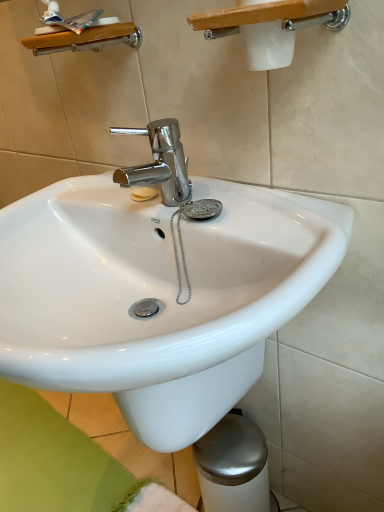
Question: Is white plastic shower at upper center, the second shower positioned from the back, at the left side of wooden shelf at upper left, the first shower in the back-to-front sequence?

Choices:
 (A) no
 (B) yes

Answer: (A)

Question: From the image's perspective, is white plastic shower at upper center, the 1th shower positioned from the right, under wooden shelf at upper left, the first shower in the back-to-front sequence?

Choices:
 (A) yes
 (B) no

Answer: (A)

Question: Is white plastic shower at upper center, the second shower positioned from the back, smaller than wooden shelf at upper left, the 1th shower viewed from the left?

Choices:
 (A) yes
 (B) no

Answer: (B)

Question: From a real-world perspective, is white plastic shower at upper center, the second shower in the left-to-right sequence, on top of wooden shelf at upper left, the first shower in the back-to-front sequence?

Choices:
 (A) yes
 (B) no

Answer: (B)

Question: Is there a large distance between white plastic shower at upper center, the 1th shower positioned from the right, and wooden shelf at upper left, the first shower in the back-to-front sequence?

Choices:
 (A) yes
 (B) no

Answer: (B)

Question: Does white plastic shower at upper center, the second shower positioned from the back, lie in front of wooden shelf at upper left, the second shower from the front?

Choices:
 (A) no
 (B) yes

Answer: (B)

Question: From the image's perspective, would you say white glossy sink at center is positioned over white plastic shower at upper center, the second shower positioned from the back?

Choices:
 (A) yes
 (B) no

Answer: (B)

Question: Does white glossy sink at center appear on the right side of white plastic shower at upper center, the second shower in the left-to-right sequence?

Choices:
 (A) no
 (B) yes

Answer: (A)

Question: Considering the relative sizes of white glossy sink at center and white plastic shower at upper center, which is the first shower in front-to-back order, in the image provided, is white glossy sink at center shorter than white plastic shower at upper center, which is the first shower in front-to-back order,?

Choices:
 (A) yes
 (B) no

Answer: (B)

Question: Is white glossy sink at center turned away from white plastic shower at upper center, the 1th shower positioned from the right?

Choices:
 (A) no
 (B) yes

Answer: (A)

Question: Considering the relative positions of white glossy sink at center and white plastic shower at upper center, the 1th shower positioned from the right, in the image provided, is white glossy sink at center in front of white plastic shower at upper center, the 1th shower positioned from the right,?

Choices:
 (A) yes
 (B) no

Answer: (A)

Question: Is white plastic shower at upper center, the second shower positioned from the back, surrounded by white glossy sink at center?

Choices:
 (A) no
 (B) yes

Answer: (A)

Question: Does white plastic shower at upper center, which is the first shower in front-to-back order, lie in front of white glossy sink at center?

Choices:
 (A) no
 (B) yes

Answer: (A)